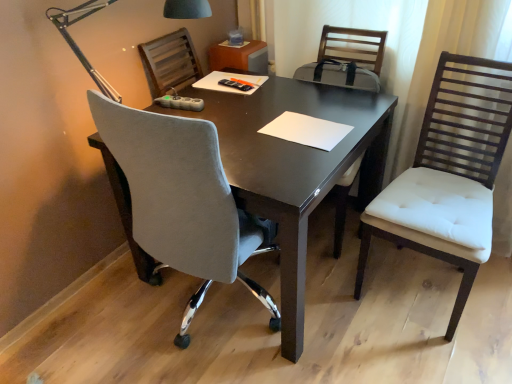
Question: Is metallic gray lamp at upper left not close to white tufted armchair at center?

Choices:
 (A) no
 (B) yes

Answer: (B)

Question: Considering the relative sizes of metallic gray lamp at upper left and white tufted armchair at center in the image provided, is metallic gray lamp at upper left bigger than white tufted armchair at center?

Choices:
 (A) no
 (B) yes

Answer: (A)

Question: Could white tufted armchair at center be considered to be inside metallic gray lamp at upper left?

Choices:
 (A) no
 (B) yes

Answer: (A)

Question: Is metallic gray lamp at upper left looking in the opposite direction of white tufted armchair at center?

Choices:
 (A) yes
 (B) no

Answer: (B)

Question: Is metallic gray lamp at upper left facing towards white tufted armchair at center?

Choices:
 (A) no
 (B) yes

Answer: (A)

Question: Is metallic gray lamp at upper left to the left of white tufted armchair at center from the viewer's perspective?

Choices:
 (A) no
 (B) yes

Answer: (B)

Question: From the image's perspective, is white tufted armchair at center on velvet grey chair at center, which ranks as the 1th chair in left-to-right order?

Choices:
 (A) no
 (B) yes

Answer: (B)

Question: From a real-world perspective, does white tufted armchair at center sit lower than velvet grey chair at center, acting as the second chair starting from the right?

Choices:
 (A) yes
 (B) no

Answer: (B)

Question: Does white tufted armchair at center turn towards velvet grey chair at center, which ranks as the 1th chair in left-to-right order?

Choices:
 (A) yes
 (B) no

Answer: (A)

Question: From the image's perspective, is white tufted armchair at center beneath velvet grey chair at center, which ranks as the 1th chair in left-to-right order?

Choices:
 (A) yes
 (B) no

Answer: (B)

Question: Are white tufted armchair at center and velvet grey chair at center, acting as the second chair starting from the right, located far from each other?

Choices:
 (A) yes
 (B) no

Answer: (B)

Question: Is white tufted armchair at center thinner than velvet grey chair at center, acting as the second chair starting from the right?

Choices:
 (A) no
 (B) yes

Answer: (B)

Question: Is white tufted cushion chair at right, acting as the 1th chair starting from the right, oriented towards white paper at center?

Choices:
 (A) yes
 (B) no

Answer: (B)